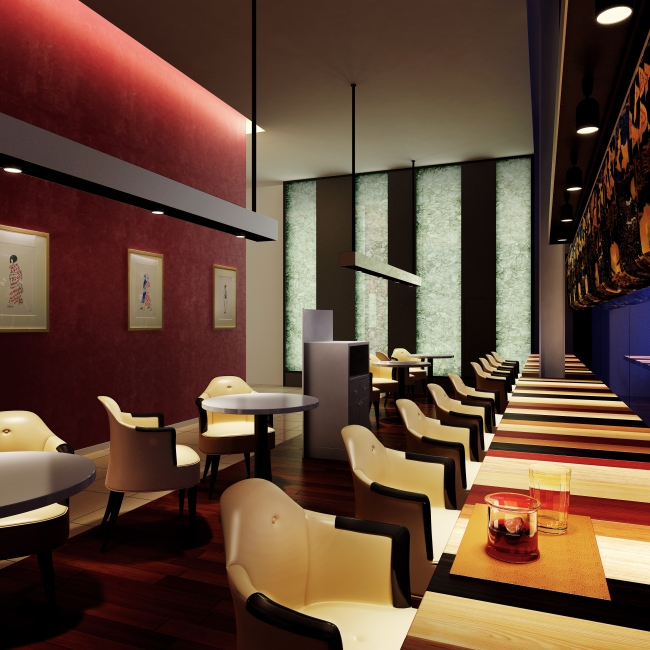
You are a GUI agent. You are given a task and a screenshot of the screen. Output one action in this format:
    pyautogui.click(x=<x>, y=<y>)
    Task: Click on the round table
    
    Given the screenshot: What is the action you would take?
    pyautogui.click(x=38, y=468), pyautogui.click(x=275, y=405), pyautogui.click(x=385, y=361), pyautogui.click(x=431, y=353)